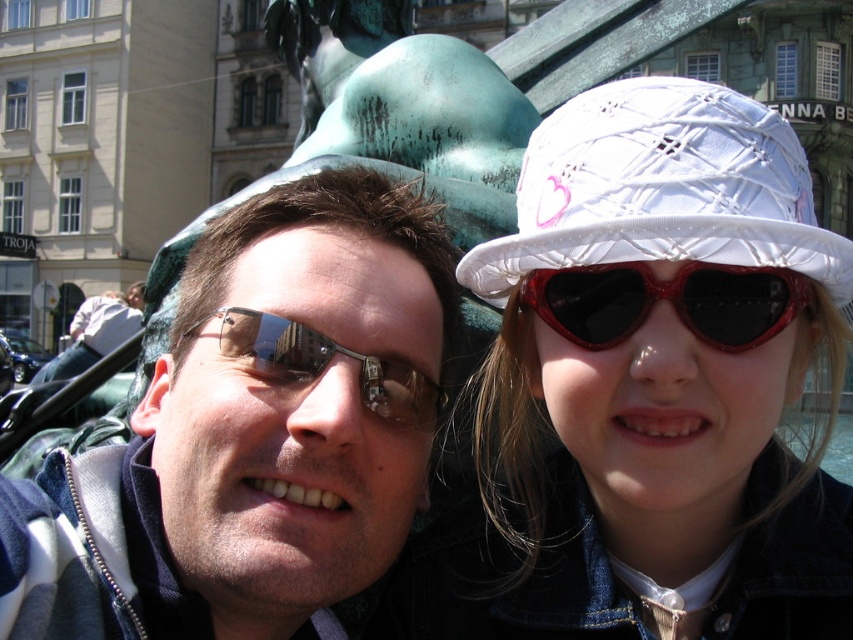
Question: Is the position of white quilted hat at upper right less distant than that of metallic sunglasses at center?

Choices:
 (A) no
 (B) yes

Answer: (A)

Question: Estimate the real-world distances between objects in this image. Which object is farther from the white woven hat at upper right?

Choices:
 (A) red shiny heart-shaped sunglasses at upper right
 (B) white quilted hat at upper right
 (C) metallic reflective sunglasses at center

Answer: (C)

Question: Does white quilted hat at upper right appear over white woven hat at upper right?

Choices:
 (A) yes
 (B) no

Answer: (B)

Question: Which object is farther from the camera taking this photo?

Choices:
 (A) red shiny heart-shaped sunglasses at upper right
 (B) metallic reflective sunglasses at center

Answer: (B)

Question: Which object is positioned closest to the red shiny heart-shaped sunglasses at upper right?

Choices:
 (A) metallic sunglasses at center
 (B) white woven hat at upper right
 (C) white quilted hat at upper right
 (D) metallic reflective sunglasses at center

Answer: (B)

Question: Is white quilted hat at upper right to the right of white woven hat at upper right from the viewer's perspective?

Choices:
 (A) yes
 (B) no

Answer: (A)